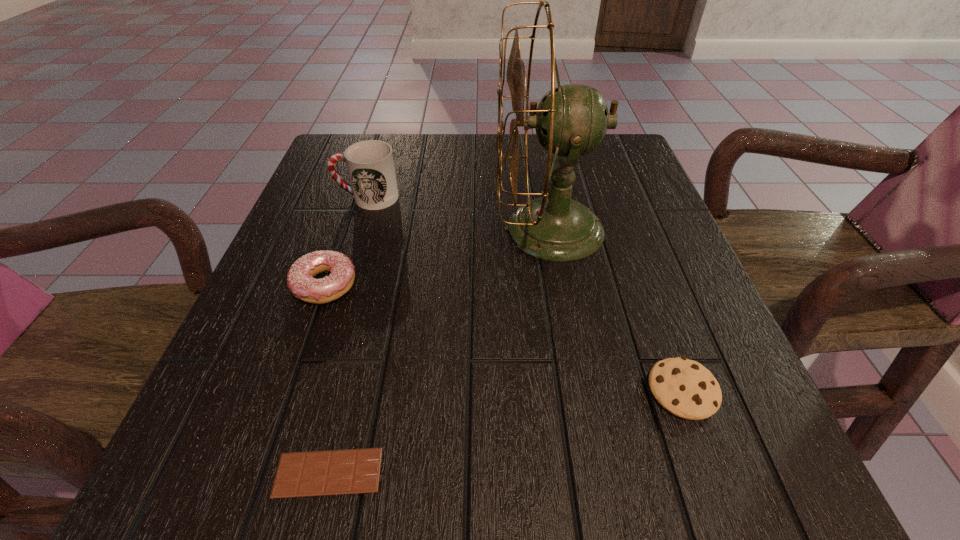
Identify the location of vacant area situated 0.280m on the back of the doughnut. Image resolution: width=960 pixels, height=540 pixels. (360, 183).

The height and width of the screenshot is (540, 960). Find the location of `vacant area situated 0.320m on the left of the second nearest object`. vacant area situated 0.320m on the left of the second nearest object is located at coordinates (432, 390).

Locate an element on the screen. vacant space located 0.330m on the back of the chocolate bar is located at coordinates (375, 275).

Find the location of `object that is positioned at the far edge`. object that is positioned at the far edge is located at coordinates (571, 120).

The height and width of the screenshot is (540, 960). What are the coordinates of `object that is at the near edge` in the screenshot? It's located at (318, 473).

Find the location of a particular element. This screenshot has width=960, height=540. cup present at the left edge is located at coordinates (370, 164).

Image resolution: width=960 pixels, height=540 pixels. What are the coordinates of `doughnut located at the left edge` in the screenshot? It's located at (300, 279).

Identify the location of chocolate bar that is at the left edge. (318, 473).

The width and height of the screenshot is (960, 540). What are the coordinates of `fan present at the right edge` in the screenshot? It's located at (571, 120).

Find the location of a particular element. cookie at the right edge is located at coordinates (685, 388).